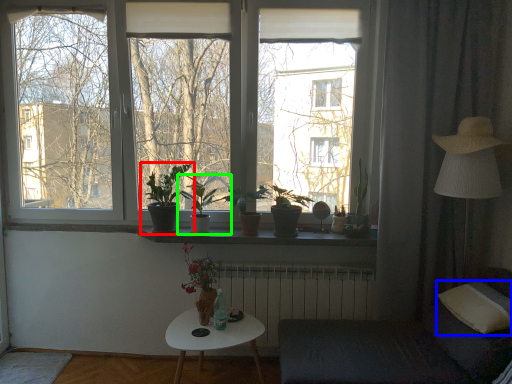
Question: Which object is the farthest from houseplant (highlighted by a red box)? Choose among these: pillow (highlighted by a blue box) or houseplant (highlighted by a green box).

Choices:
 (A) pillow
 (B) houseplant

Answer: (A)